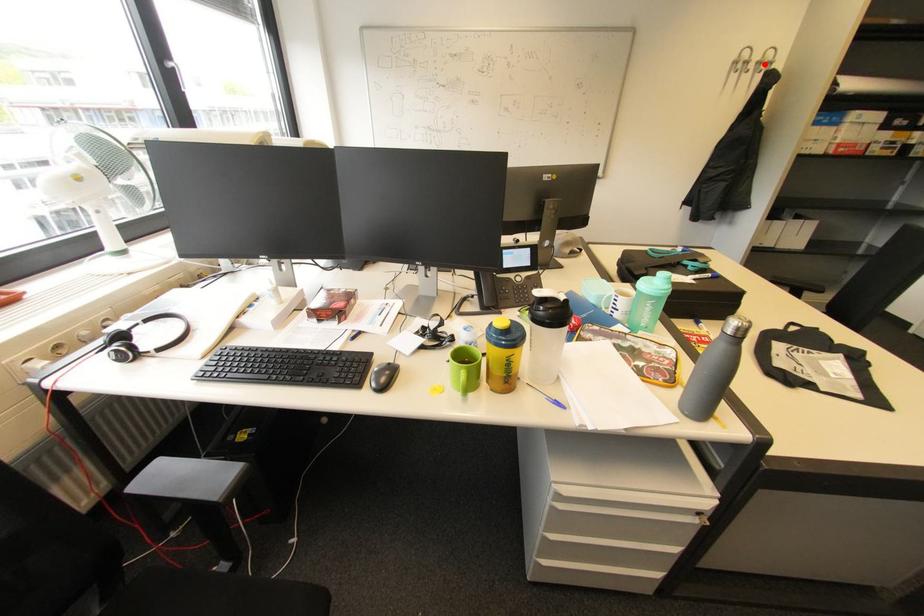
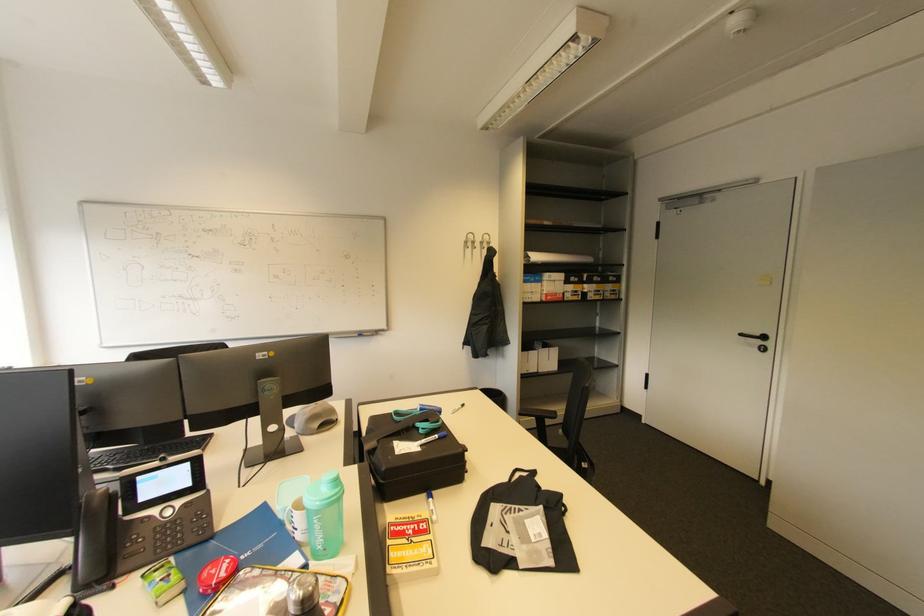
Where in the second image is the point corresponding to the highlighted location from the first image?

(487, 244)